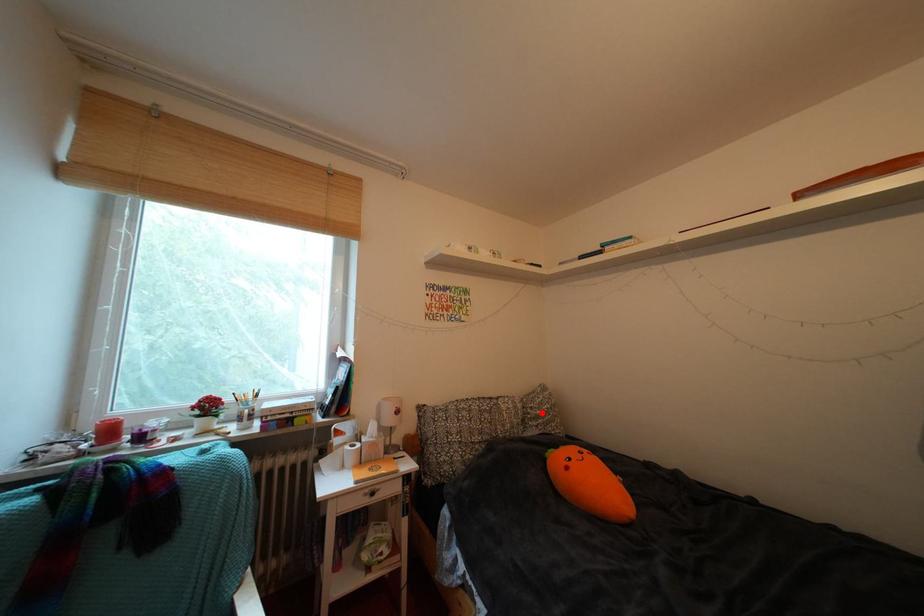
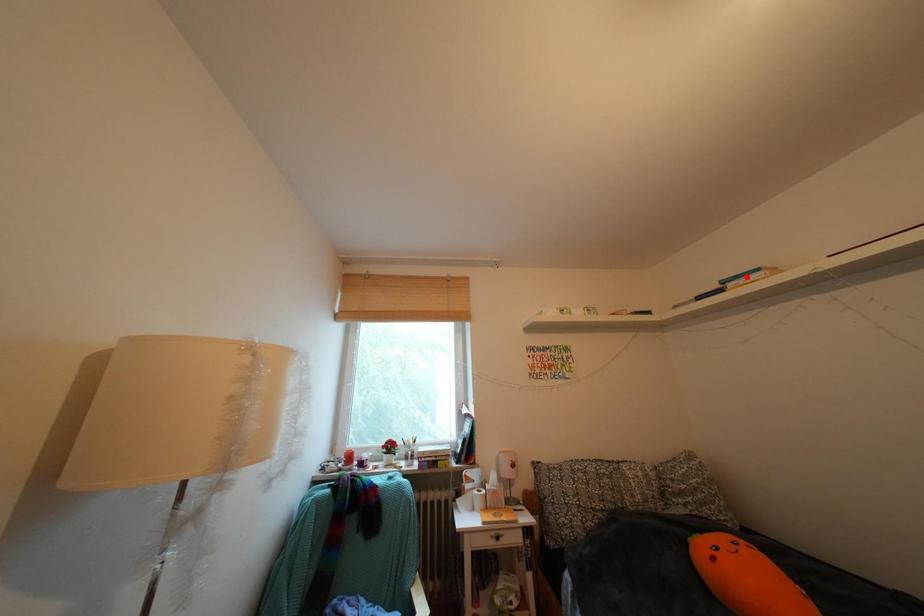
I am providing you with two images of the same scene from different viewpoints. A red point is marked on the first image and another point is marked on the second image. Is the marked point in image1 the same physical position as the marked point in image2?

No